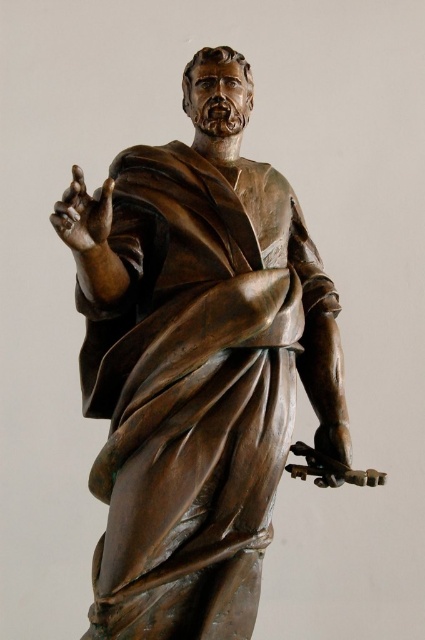
Which is above, bronze statue hand at upper left or bronze statue hand at lower right?

Positioned higher is bronze statue hand at upper left.

Is bronze statue hand at upper left to the left of bronze statue hand at lower right from the viewer's perspective?

Yes, bronze statue hand at upper left is to the left of bronze statue hand at lower right.

Is point (67, 205) in front of point (342, 460)?

Yes.

Find the location of a particular element. The image size is (425, 640). bronze statue hand at upper left is located at coordinates (84, 216).

Between bronze statue at center and bronze statue hand at upper left, which one has less height?

bronze statue hand at upper left is shorter.

Does bronze statue at center appear on the right side of bronze statue hand at upper left?

Indeed, bronze statue at center is positioned on the right side of bronze statue hand at upper left.

In order to click on bronze statue at center in this screenshot , I will do `click(198, 368)`.

Between bronze statue at center and bronze statue hand at lower right, which one is positioned higher?

bronze statue at center

This screenshot has height=640, width=425. What do you see at coordinates (198, 368) in the screenshot? I see `bronze statue at center` at bounding box center [198, 368].

Where is `bronze statue at center`? This screenshot has height=640, width=425. bronze statue at center is located at coordinates click(x=198, y=368).